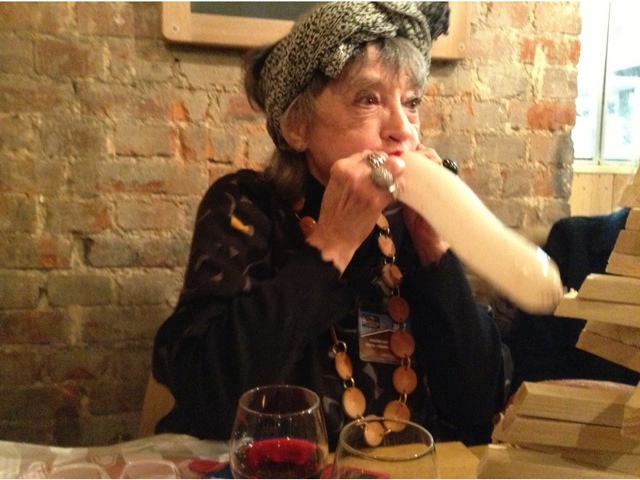
This screenshot has width=640, height=480. In order to click on wooden frame in this screenshot , I will do point(210,25).